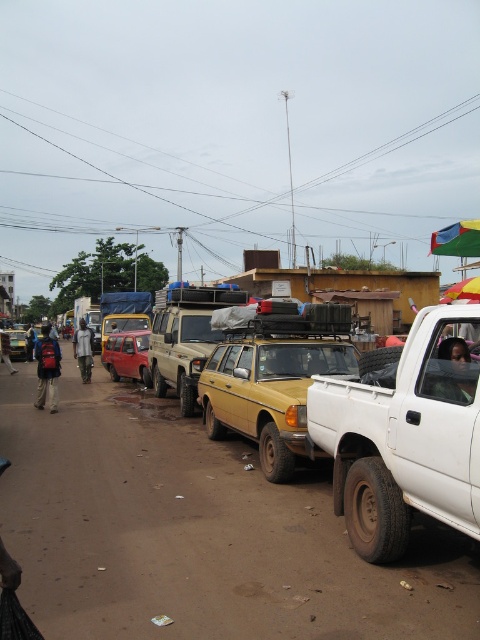
Describe the element at coordinates (406, 433) in the screenshot. This screenshot has width=480, height=640. I see `white matte pickup truck at center` at that location.

Between point (471, 481) and point (203, 364), which one is positioned in front?

Point (471, 481) is more forward.

You are a GUI agent. You are given a task and a screenshot of the screen. Output one action in this format:
    pyautogui.click(x=<x>, y=<y>)
    Task: Click on the white matte pickup truck at center
    
    Given the screenshot: What is the action you would take?
    [x=406, y=433]

Who is positioned more to the left, metallic red van at center or red backpack at left?

red backpack at left

Does point (112, 380) come behind point (55, 368)?

Yes.

The width and height of the screenshot is (480, 640). What are the coordinates of `metallic red van at center` in the screenshot? It's located at (127, 355).

Does matte black car at left have a larger size compared to blue fabric bag at left?

Actually, matte black car at left might be smaller than blue fabric bag at left.

Is point (11, 339) positioned before point (28, 337)?

Yes, it is.

Identify the location of matte black car at left. This screenshot has width=480, height=640. (16, 344).